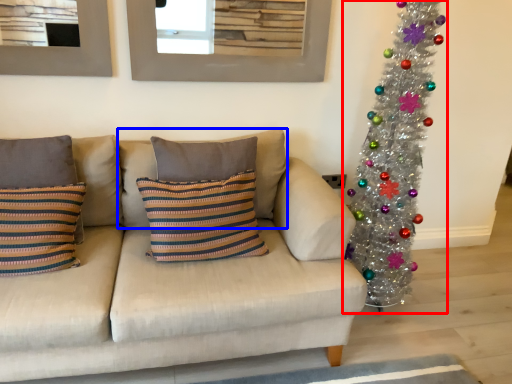
Question: Which object appears closest to the camera in this image, christmas tree (highlighted by a red box) or pillow (highlighted by a blue box)?

Choices:
 (A) christmas tree
 (B) pillow

Answer: (A)